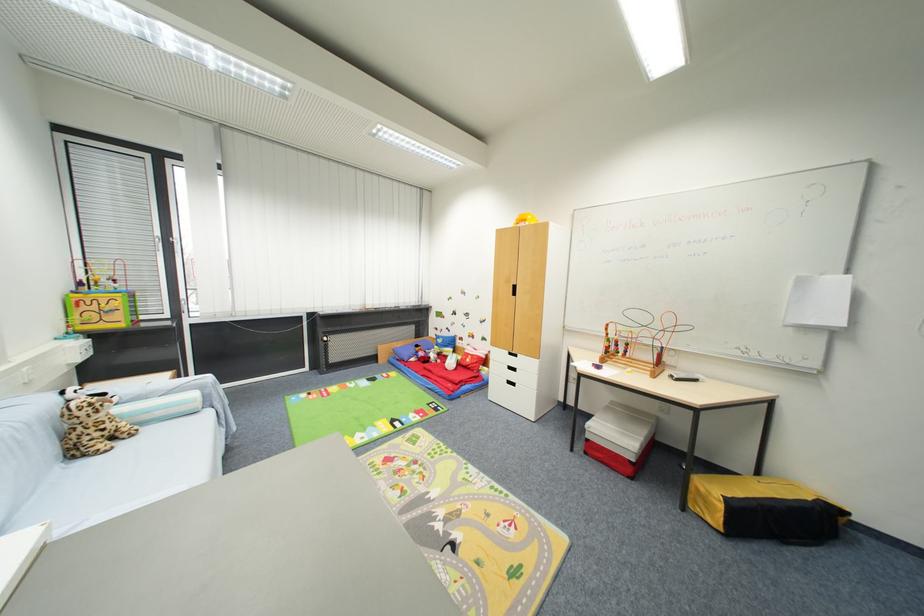
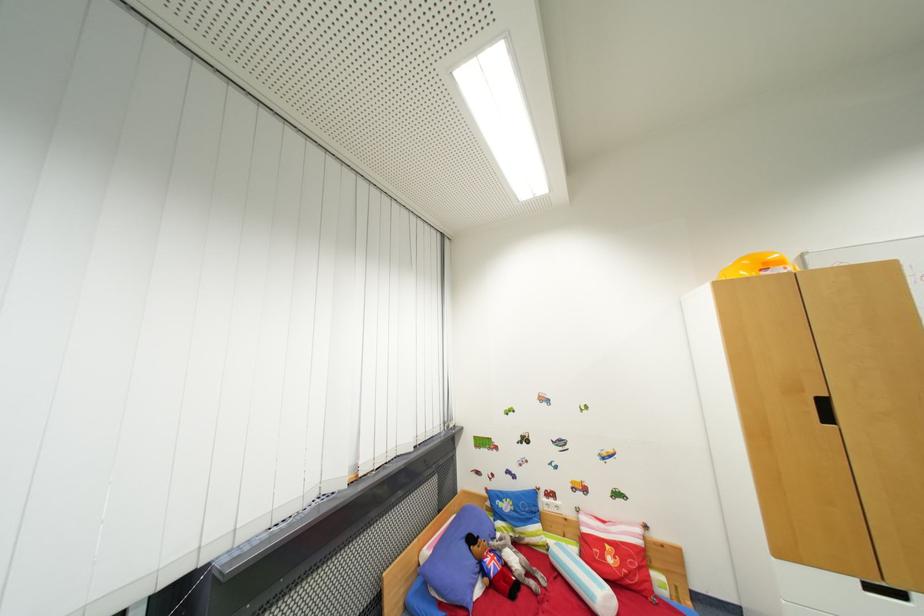
Where in the second image is the point corresponding to pixel 519 294 from the first image?

(833, 419)